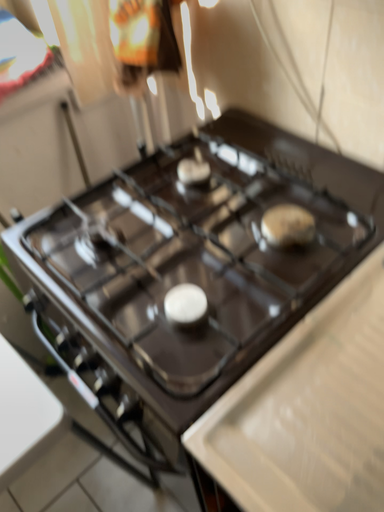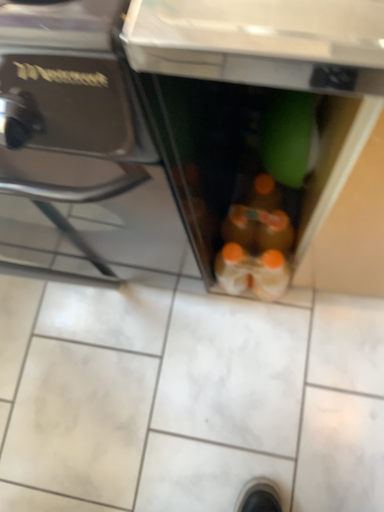
Question: Which way did the camera rotate in the video?

Choices:
 (A) rotated downward
 (B) rotated upward

Answer: (A)